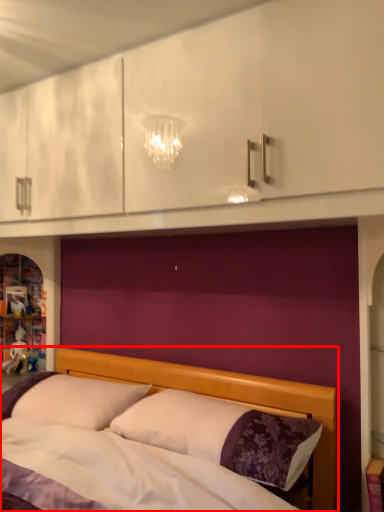
Question: From the image's perspective, where is bed (annotated by the red box) located in relation to pillow in the image?

Choices:
 (A) below
 (B) above

Answer: (A)